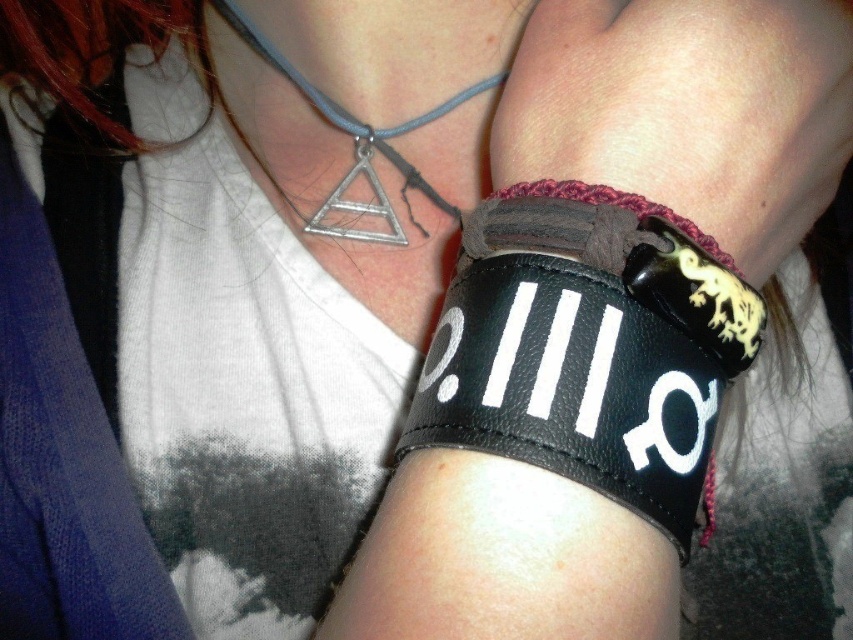
Question: Does black leather bracelet at right appear on the left side of silver metallic triangle at upper center?

Choices:
 (A) yes
 (B) no

Answer: (B)

Question: Which object is farther from the camera taking this photo?

Choices:
 (A) silver metallic triangle at upper center
 (B) black leather bracelet at right

Answer: (A)

Question: Which point is farther to the camera?

Choices:
 (A) silver metallic triangle at upper center
 (B) black leather bracelet at right

Answer: (A)

Question: Which object is closer to the camera taking this photo?

Choices:
 (A) silver metallic triangle at upper center
 (B) black leather bracelet at right

Answer: (B)

Question: Does black leather bracelet at right lie behind silver metallic triangle at upper center?

Choices:
 (A) no
 (B) yes

Answer: (A)

Question: Is black leather bracelet at right further to the viewer compared to silver metallic triangle at upper center?

Choices:
 (A) yes
 (B) no

Answer: (B)